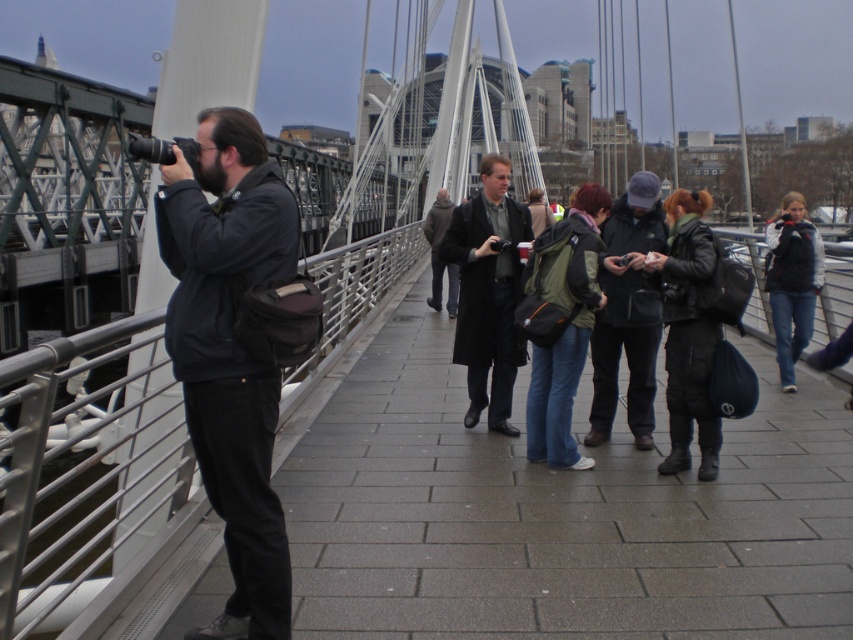
Question: Based on their relative distances, which object is nearer to the dark gray knit cap at center?

Choices:
 (A) black fabric bag at left
 (B) dark brown wool coat at center

Answer: (B)

Question: Which object is positioned closest to the dark gray coat at center?

Choices:
 (A) dark gray knit cap at center
 (B) black fabric bag at left
 (C) denim jacket at right
 (D) dark gray jacket at left

Answer: (A)

Question: Which object is positioned farthest from the dark gray knit cap at center?

Choices:
 (A) dark brown wool coat at center
 (B) leather jacket at center
 (C) dark gray coat at center
 (D) dark gray jacket at left

Answer: (A)

Question: Does green fabric backpack at center appear on the left side of denim jacket at right?

Choices:
 (A) no
 (B) yes

Answer: (B)

Question: Can you confirm if dark gray jacket at left is positioned to the right of denim jacket at right?

Choices:
 (A) no
 (B) yes

Answer: (A)

Question: Is the position of denim jacket at right less distant than that of dark brown wool coat at center?

Choices:
 (A) yes
 (B) no

Answer: (B)